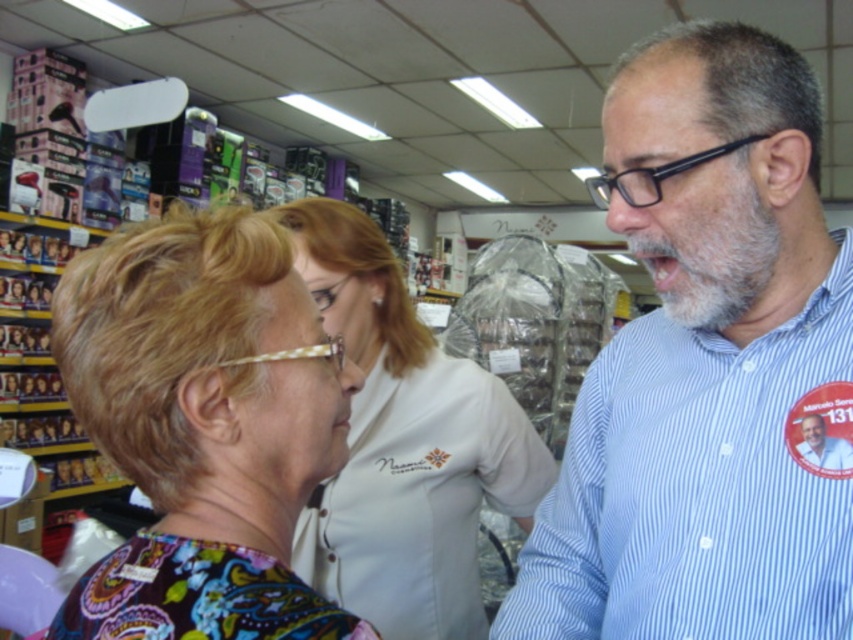
Question: Which point is farther to the camera?

Choices:
 (A) (625, 333)
 (B) (376, 268)
 (C) (276, 577)

Answer: (B)

Question: Which object is closer to the camera taking this photo?

Choices:
 (A) multicolored fabric blouse at center
 (B) blue striped shirt at center

Answer: (A)

Question: Is blue striped shirt at right below blue striped shirt at center?

Choices:
 (A) yes
 (B) no

Answer: (B)

Question: Is multicolored fabric blouse at center to the left of white fabric shirt at center from the viewer's perspective?

Choices:
 (A) no
 (B) yes

Answer: (B)

Question: Considering the relative positions of blue striped shirt at right and white fabric shirt at center in the image provided, where is blue striped shirt at right located with respect to white fabric shirt at center?

Choices:
 (A) left
 (B) right

Answer: (B)

Question: Which point is closer to the camera taking this photo?

Choices:
 (A) (468, 550)
 (B) (646, 340)
 (C) (131, 540)

Answer: (C)